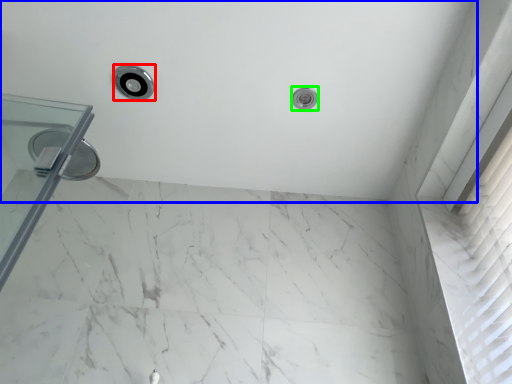
Question: Which object is positioned closest to shower (highlighted by a red box)? Select from bath (highlighted by a blue box) and shower (highlighted by a green box).

Choices:
 (A) bath
 (B) shower

Answer: (A)